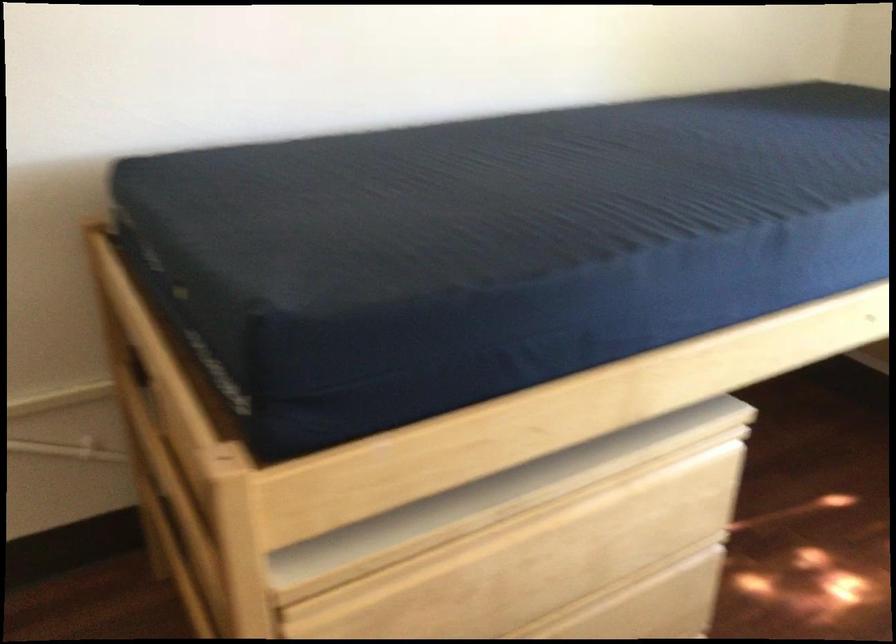
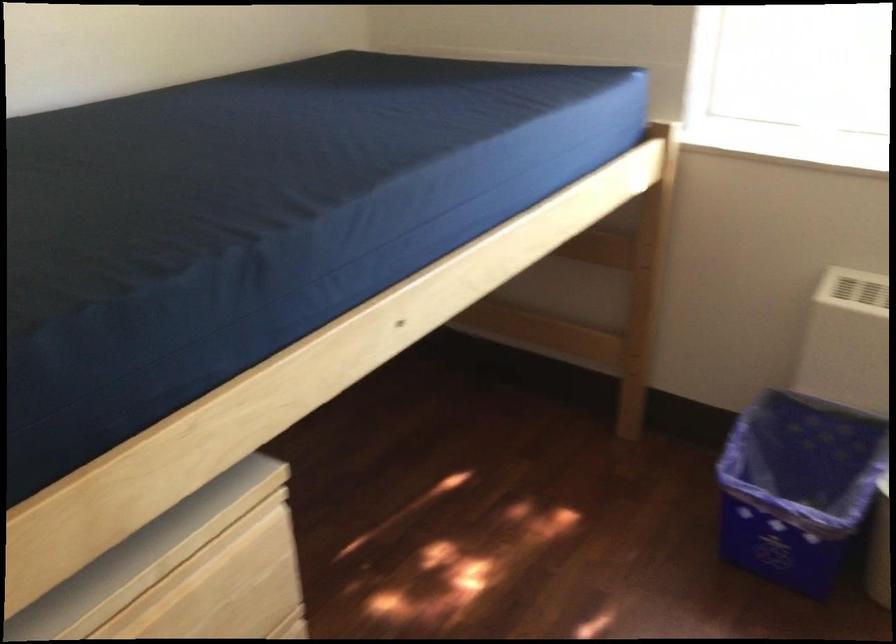
Question: The camera is either moving clockwise (left) or counter-clockwise (right) around the object. The first image is from the beginning of the video and the second image is from the end. Is the camera moving left or right when shooting the video?

Choices:
 (A) Left
 (B) Right

Answer: (A)